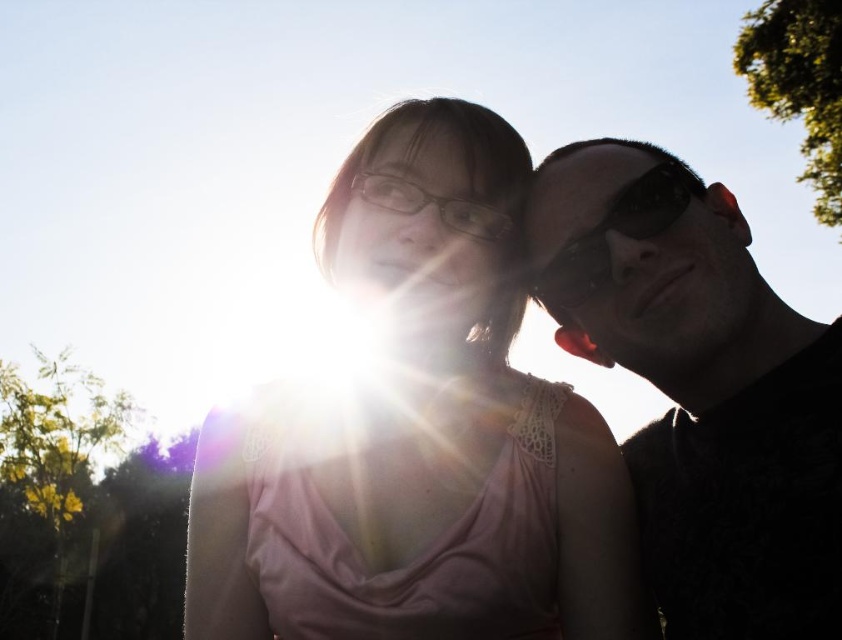
What is the purpose of the point at coordinates (702,392) in the image?

The point at coordinates (702,392) is located on the black matte sunglasses worn by the person on the right.

You are a photographer trying to adjust the focus of your camera to capture both the pink lace tank top at center and the black reflective sunglasses at right. Which object should you focus on first if you want to ensure the one closer to the camera is sharp?

The black reflective sunglasses at right are closer to the camera than the pink lace tank top at center, so you should focus on the black reflective sunglasses at right first.

What are the coordinates of the pink lace tank top at center?

The pink lace tank top at center is located at coordinates (419, 435).